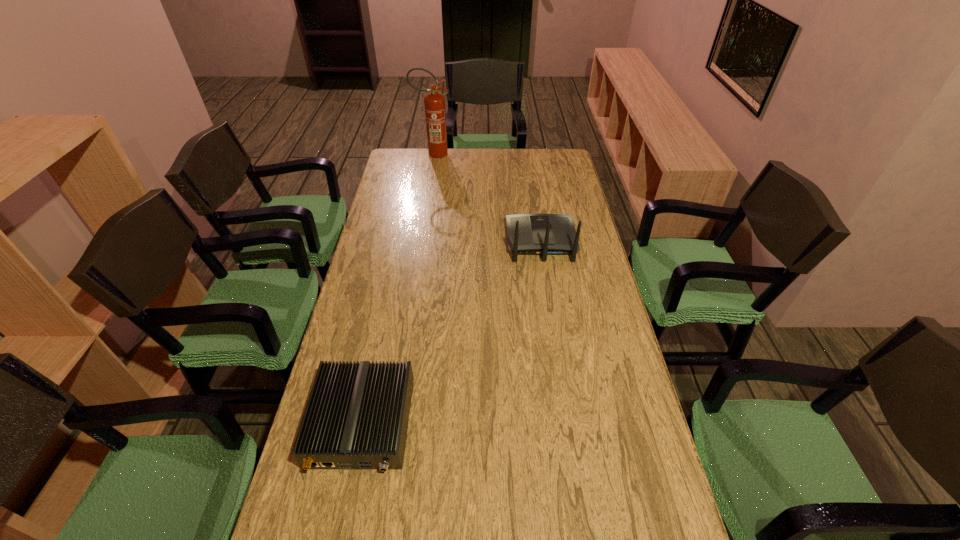
Find the location of a particular element. fire extinguisher is located at coordinates (435, 113).

I want to click on the farthest object, so click(435, 113).

The image size is (960, 540). I want to click on the second shortest object, so click(528, 234).

Identify the location of the taller router. (528, 234).

Locate an element on the screen. the left router is located at coordinates (357, 415).

This screenshot has width=960, height=540. Find the location of `the nearest object`. the nearest object is located at coordinates pyautogui.click(x=357, y=415).

Find the location of a particular element. Image resolution: width=960 pixels, height=540 pixels. vacant space situated from the nozzle of the tallest object is located at coordinates (511, 154).

I want to click on free spot located on the front-facing side of the taller router, so click(x=533, y=190).

Identify the location of free spot located 0.110m on the front-facing side of the taller router. This screenshot has height=540, width=960. (536, 205).

Find the location of a particular element. free space located on the front-facing side of the taller router is located at coordinates (535, 197).